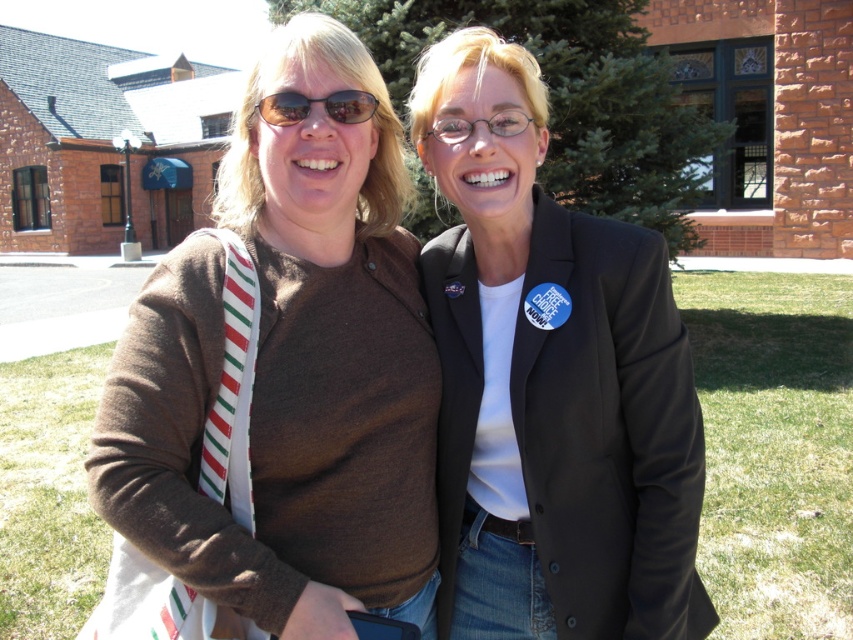
Question: Does brown cotton sweater at center have a greater width compared to black matte blazer at center?

Choices:
 (A) no
 (B) yes

Answer: (A)

Question: Among these objects, which one is nearest to the camera?

Choices:
 (A) matte black sunglasses at center
 (B) brown cotton sweater at center
 (C) black matte blazer at center

Answer: (B)

Question: Does black matte blazer at center have a lesser width compared to matte black sunglasses at center?

Choices:
 (A) no
 (B) yes

Answer: (A)

Question: Which object is the farthest from the brown cotton sweater at center?

Choices:
 (A) matte black sunglasses at center
 (B) black matte blazer at center

Answer: (B)

Question: Is brown cotton sweater at center bigger than matte black sunglasses at center?

Choices:
 (A) no
 (B) yes

Answer: (B)

Question: Considering the real-world distances, which object is farthest from the white striped fabric tie at left?

Choices:
 (A) brown cotton sweater at center
 (B) matte black sunglasses at center

Answer: (B)